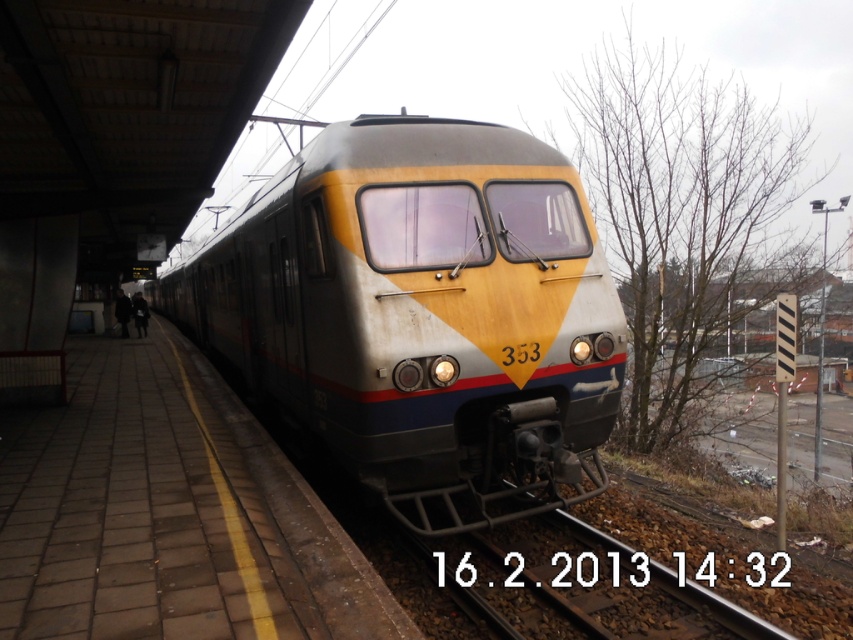
You are a passenger waiting at the train station. You see the matte gray train at center and the brown gravel train track at lower center. Which object is closer to the edge of the platform?

The matte gray train at center is closer to the edge of the platform because it is positioned to the left of the brown gravel train track at lower center, which is further away from the edge.

You are a passenger waiting at the train station. You notice the matte gray train at center and the brown gravel train track at lower center. Which object is located above the other?

The matte gray train at center is positioned over the brown gravel train track at lower center, so the train is above the track.

You are a maintenance worker needing to walk along the brown gravel train track at lower center to inspect it. However, there is a matte gray train at center parked on the track. Can you safely walk along the track while avoiding the train?

The matte gray train at center is wider than the brown gravel train track at lower center. Therefore, the train cannot fully occupy the track, leaving space for you to walk safely along the track while avoiding the train.